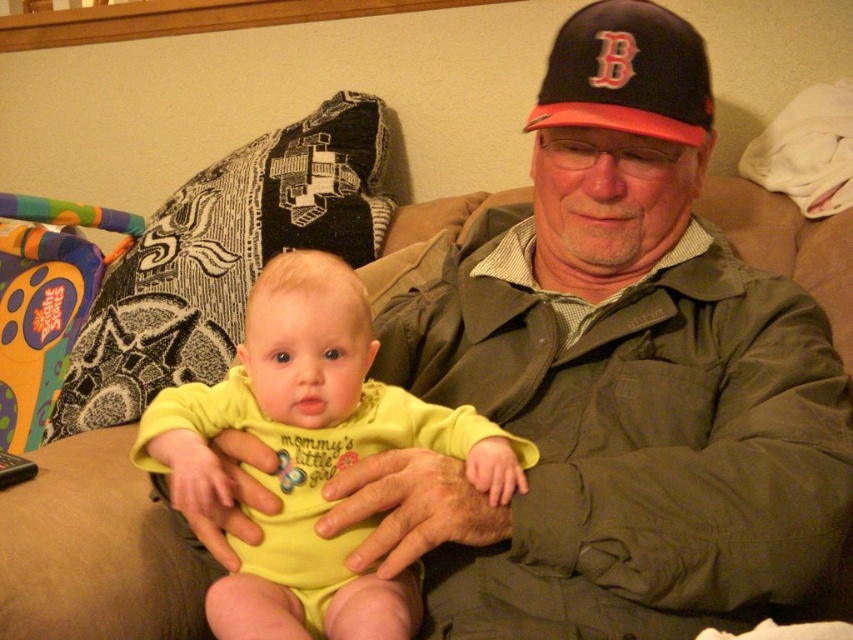
You are a photographer trying to capture a closeup of the black fabric baseball cap at upper center without including the yellow soft fabric baby at center in the shot. Is this possible given their positions?

The yellow soft fabric baby at center is located below the black fabric baseball cap at upper center, so yes, the photographer can focus on the black fabric baseball cap at upper center and avoid including the baby in the frame by adjusting the camera angle or zoom.

You are a photographer trying to focus on two points in the image. The first point is at coordinates point (360, 312) and the second is at point (578, 40). Which point is closer to the camera?

Point (360, 312) is closer to the camera than point (578, 40).

You are a photographer taking a picture of the yellow soft fabric baby at center and the black fabric baseball cap at upper center. Which object should you focus on first if you want to capture both in sharp detail?

The yellow soft fabric baby at center should be focused on first because it is larger than the black fabric baseball cap at upper center, making it the primary subject.